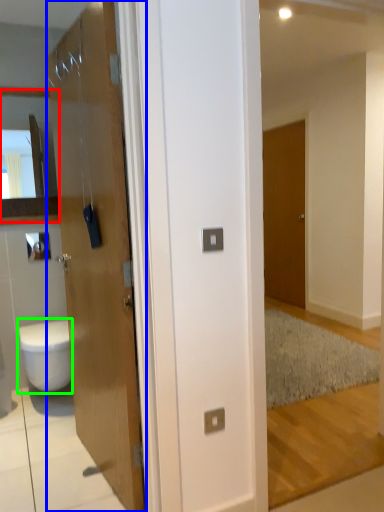
Question: Considering the real-world distances, which object is closest to cabinet (highlighted by a red box)? door (highlighted by a blue box) or bidet (highlighted by a green box).

Choices:
 (A) door
 (B) bidet

Answer: (B)